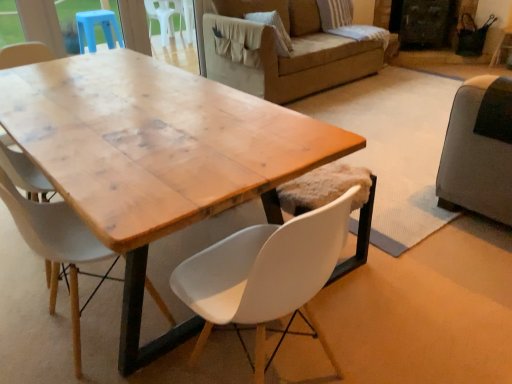
Question: Should I look upward or downward to see black matte screen door at upper right?

Choices:
 (A) down
 (B) up

Answer: (B)

Question: Is dark gray fabric couch at right positioned with its back to striped fabric pillow at upper right?

Choices:
 (A) no
 (B) yes

Answer: (A)

Question: Is dark gray fabric couch at right positioned in front of striped fabric pillow at upper right?

Choices:
 (A) no
 (B) yes

Answer: (B)

Question: Can you confirm if dark gray fabric couch at right is thinner than striped fabric pillow at upper right?

Choices:
 (A) no
 (B) yes

Answer: (B)

Question: From the image's perspective, is dark gray fabric couch at right located beneath striped fabric pillow at upper right?

Choices:
 (A) yes
 (B) no

Answer: (A)

Question: Can we say dark gray fabric couch at right lies outside striped fabric pillow at upper right?

Choices:
 (A) yes
 (B) no

Answer: (A)

Question: From a real-world perspective, is dark gray fabric couch at right positioned under striped fabric pillow at upper right based on gravity?

Choices:
 (A) no
 (B) yes

Answer: (B)

Question: Is striped fabric pillow at upper right taller than dark gray fabric couch at right?

Choices:
 (A) yes
 (B) no

Answer: (B)

Question: From the image's perspective, is striped fabric pillow at upper right under dark gray fabric couch at right?

Choices:
 (A) yes
 (B) no

Answer: (B)

Question: Can you confirm if striped fabric pillow at upper right is wider than dark gray fabric couch at right?

Choices:
 (A) yes
 (B) no

Answer: (A)

Question: Considering the relative positions of striped fabric pillow at upper right and dark gray fabric couch at right in the image provided, is striped fabric pillow at upper right to the left of dark gray fabric couch at right from the viewer's perspective?

Choices:
 (A) no
 (B) yes

Answer: (B)

Question: Is striped fabric pillow at upper right positioned with its back to dark gray fabric couch at right?

Choices:
 (A) no
 (B) yes

Answer: (A)

Question: From a real-world perspective, is striped fabric pillow at upper right located higher than dark gray fabric couch at right?

Choices:
 (A) no
 (B) yes

Answer: (B)

Question: Does white matte chair at center, the first chair when ordered from left to right, have a lesser width compared to striped fabric pillow at upper right?

Choices:
 (A) yes
 (B) no

Answer: (A)